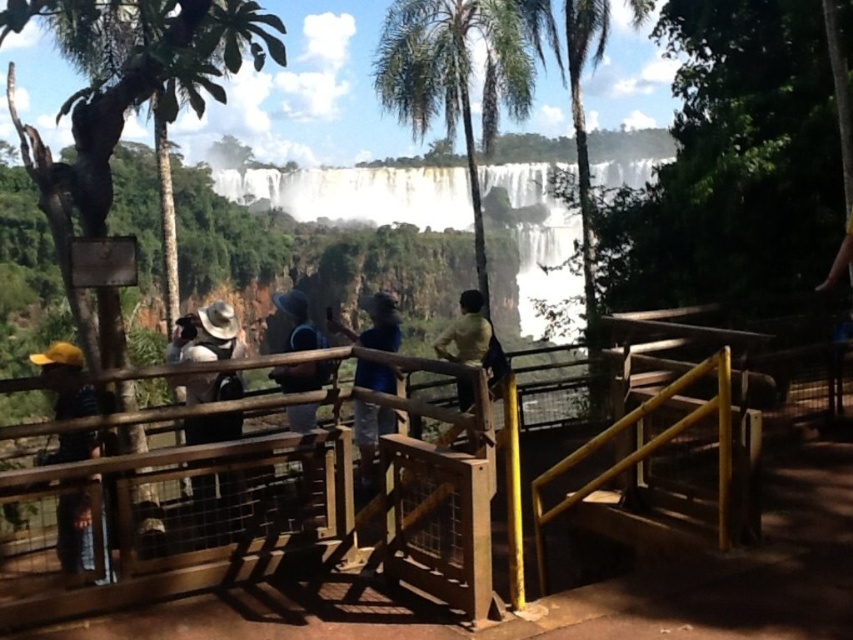
Question: Among these objects, which one is nearest to the camera?

Choices:
 (A) blue fabric hat at center
 (B) white smooth waterfall at upper center
 (C) brown fabric hat at center
 (D) green leafy palm tree at center

Answer: (A)

Question: Can you confirm if brown fabric hat at center is positioned above green matte shirt at center?

Choices:
 (A) yes
 (B) no

Answer: (B)

Question: Estimate the real-world distances between objects in this image. Which object is farther from the blue fabric hat at center?

Choices:
 (A) brown fabric hat at center
 (B) yellow fabric cap at lower left

Answer: (A)

Question: Which of the following is the farthest from the observer?

Choices:
 (A) blue fabric hat at center
 (B) green leafy palm tree at center

Answer: (B)

Question: From the image, what is the correct spatial relationship of yellow fabric cap at lower left in relation to green matte shirt at center?

Choices:
 (A) right
 (B) left

Answer: (B)

Question: Can you confirm if brown fabric hat at center is positioned below green matte shirt at center?

Choices:
 (A) no
 (B) yes

Answer: (B)